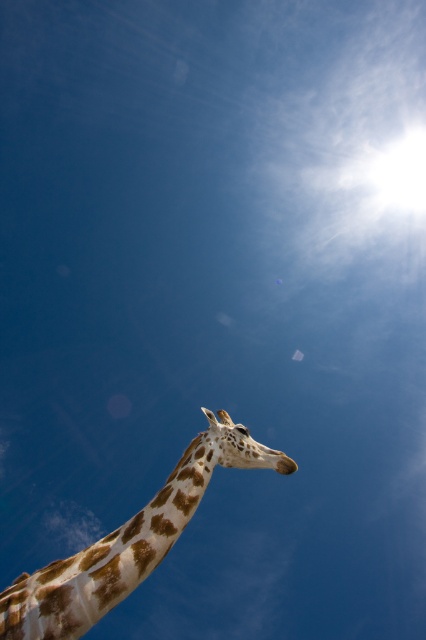
Question: Among these points, which one is farthest from the camera?

Choices:
 (A) (131, 536)
 (B) (236, 444)

Answer: (B)

Question: Does spotted fur giraffe at lower left have a greater width compared to spotted fur giraffe head at center?

Choices:
 (A) yes
 (B) no

Answer: (A)

Question: Is spotted fur giraffe at lower left to the left of spotted fur giraffe head at center from the viewer's perspective?

Choices:
 (A) yes
 (B) no

Answer: (A)

Question: Is spotted fur giraffe at lower left above spotted fur giraffe head at center?

Choices:
 (A) yes
 (B) no

Answer: (B)

Question: Which object is farther from the camera taking this photo?

Choices:
 (A) spotted fur giraffe at lower left
 (B) spotted fur giraffe head at center

Answer: (B)